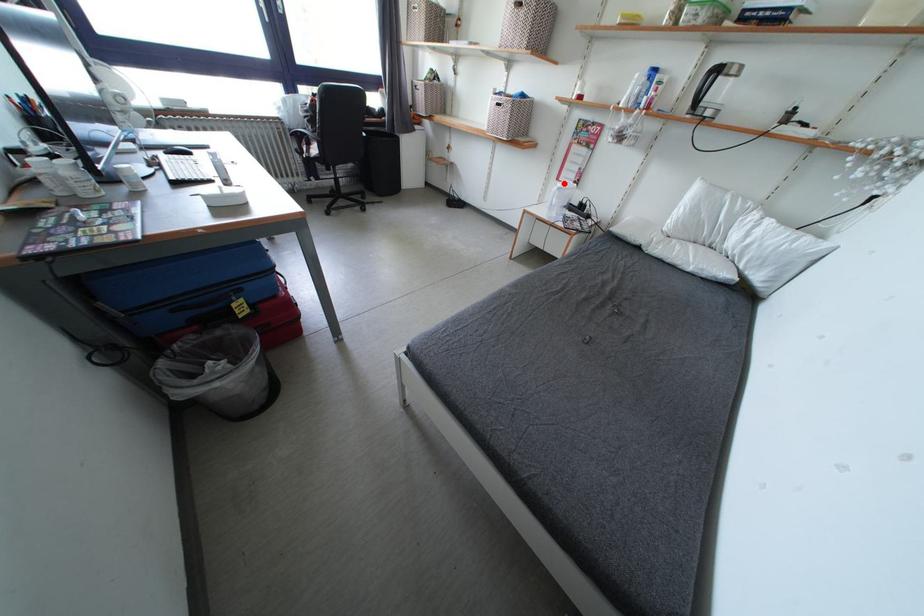
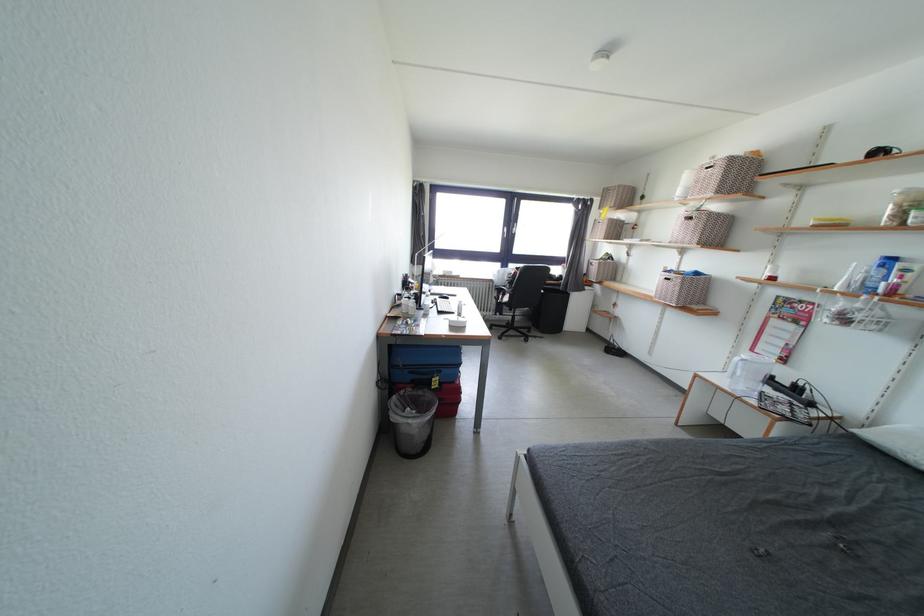
In the second image, find the point that corresponds to the highlighted location in the first image.

(759, 355)